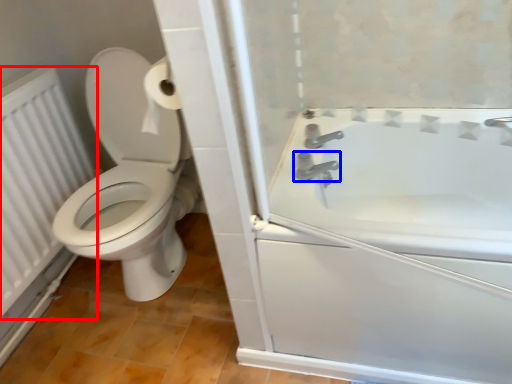
Question: Which object appears closest to the camera in this image, radiator (highlighted by a red box) or tap (highlighted by a blue box)?

Choices:
 (A) radiator
 (B) tap

Answer: (A)